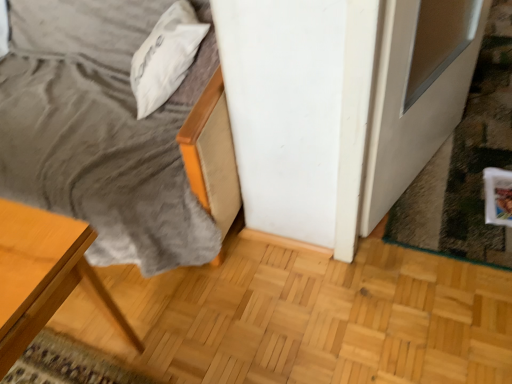
Question: From the image's perspective, is white soft pillow at upper left above or below white glossy screen door at lower right?

Choices:
 (A) below
 (B) above

Answer: (B)

Question: Considering the positions of white soft pillow at upper left and white glossy screen door at lower right in the image, is white soft pillow at upper left bigger or smaller than white glossy screen door at lower right?

Choices:
 (A) big
 (B) small

Answer: (B)

Question: Does point (156, 33) appear closer or farther from the camera than point (406, 29)?

Choices:
 (A) farther
 (B) closer

Answer: (A)

Question: Is white glossy screen door at lower right to the left or to the right of white soft pillow at upper left in the image?

Choices:
 (A) left
 (B) right

Answer: (B)

Question: From a real-world perspective, is white glossy screen door at lower right physically located above or below white soft pillow at upper left?

Choices:
 (A) below
 (B) above

Answer: (A)

Question: Looking at their shapes, would you say white glossy screen door at lower right is wider or thinner than white soft pillow at upper left?

Choices:
 (A) thin
 (B) wide

Answer: (A)

Question: In terms of height, does white glossy screen door at lower right look taller or shorter compared to white soft pillow at upper left?

Choices:
 (A) short
 (B) tall

Answer: (B)